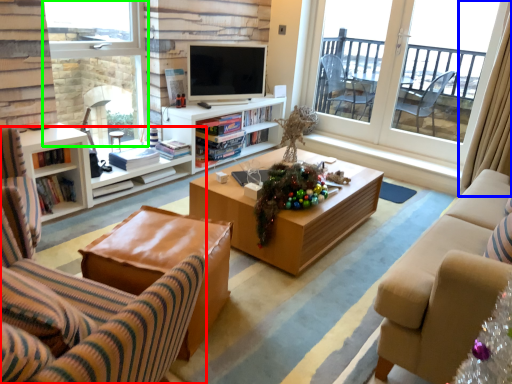
Question: Considering the real-world distances, which object is closest to chair (highlighted by a red box)? curtain (highlighted by a blue box) or window (highlighted by a green box).

Choices:
 (A) curtain
 (B) window

Answer: (B)